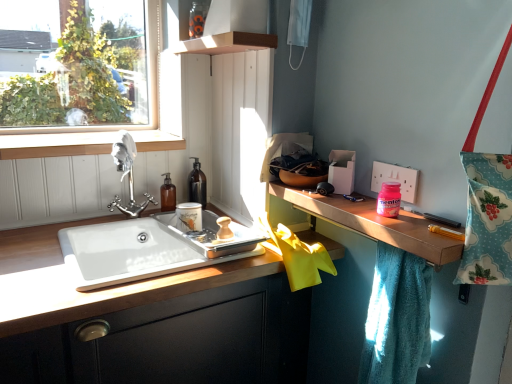
Identify the location of space that is in front of pink glossy mentos at upper right, which appears as the second toiletry when viewed from the left. (x=415, y=230).